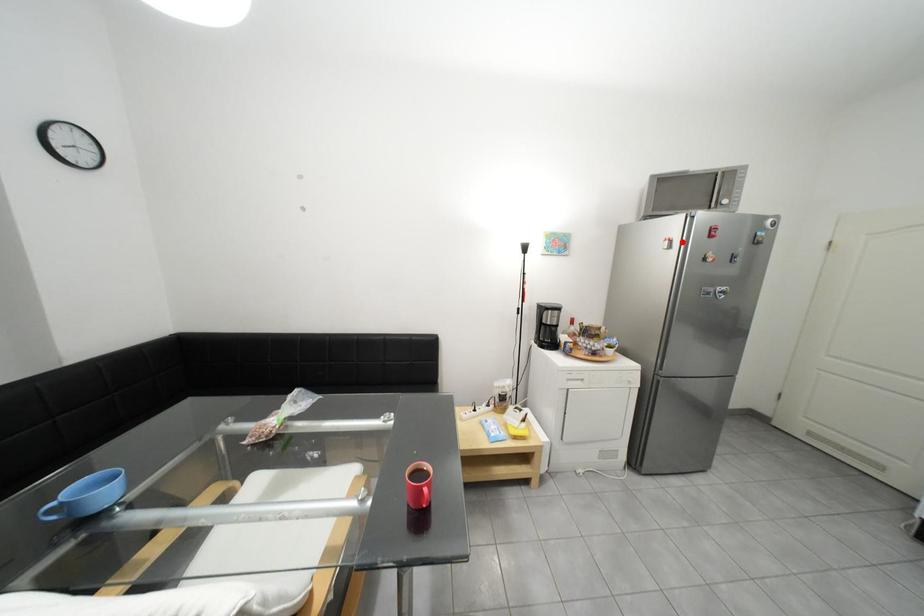
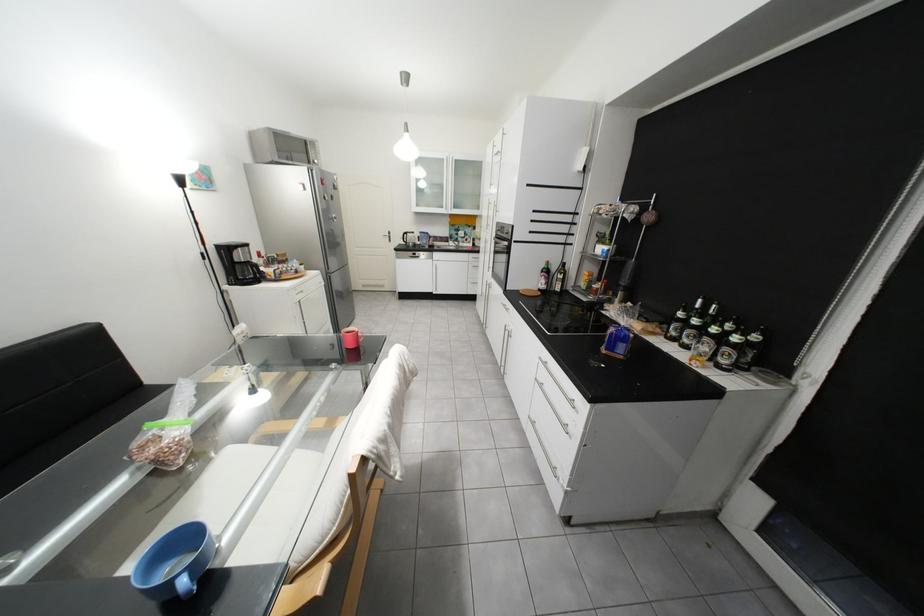
Find the pixel in the second image that matches the highlighted location in the first image.

(315, 185)